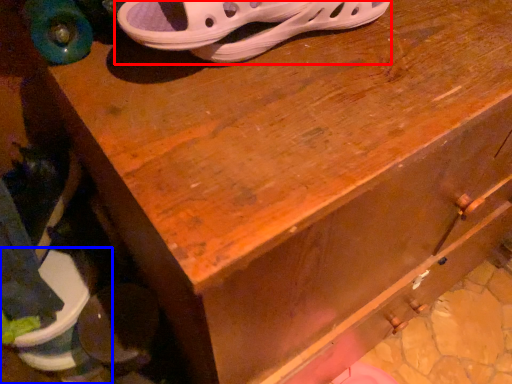
Question: Which object appears closest to the camera in this image, footwear (highlighted by a red box) or footwear (highlighted by a blue box)?

Choices:
 (A) footwear
 (B) footwear

Answer: (A)